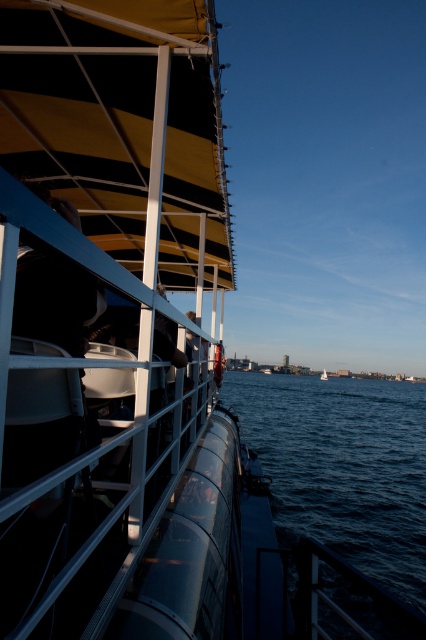
Question: Does dark blue water at lower right have a smaller size compared to white glossy sailboat at center?

Choices:
 (A) no
 (B) yes

Answer: (A)

Question: Can you confirm if dark blue water at lower right is positioned above white glossy sailboat at center?

Choices:
 (A) no
 (B) yes

Answer: (B)

Question: Which of the following is the farthest from the observer?

Choices:
 (A) (402, 392)
 (B) (321, 374)

Answer: (B)

Question: Can you confirm if dark blue water at lower right is bigger than white glossy sailboat at center?

Choices:
 (A) yes
 (B) no

Answer: (A)